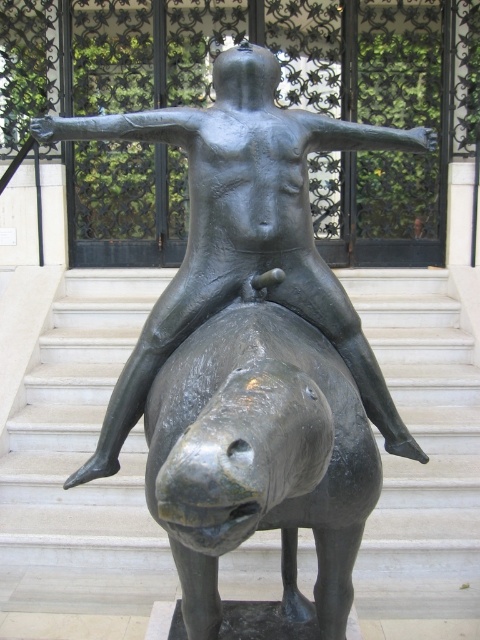
Question: Among these points, which one is nearest to the camera?

Choices:
 (A) [x=356, y=365]
 (B) [x=240, y=561]

Answer: (A)

Question: Is smooth gray horse at center bigger than bronze statue at center?

Choices:
 (A) yes
 (B) no

Answer: (A)

Question: Is smooth gray horse at center bigger than bronze statue at center?

Choices:
 (A) no
 (B) yes

Answer: (B)

Question: Where is smooth gray horse at center located in relation to bronze statue at center in the image?

Choices:
 (A) below
 (B) above

Answer: (A)

Question: Which point is farther to the camera?

Choices:
 (A) (264, 241)
 (B) (72, 435)

Answer: (B)